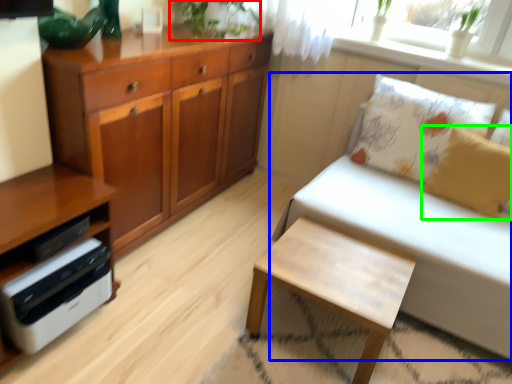
Question: Which is farther away from plant (highlighted by a red box)? studio couch (highlighted by a blue box) or pillow (highlighted by a green box)?

Choices:
 (A) studio couch
 (B) pillow

Answer: (B)